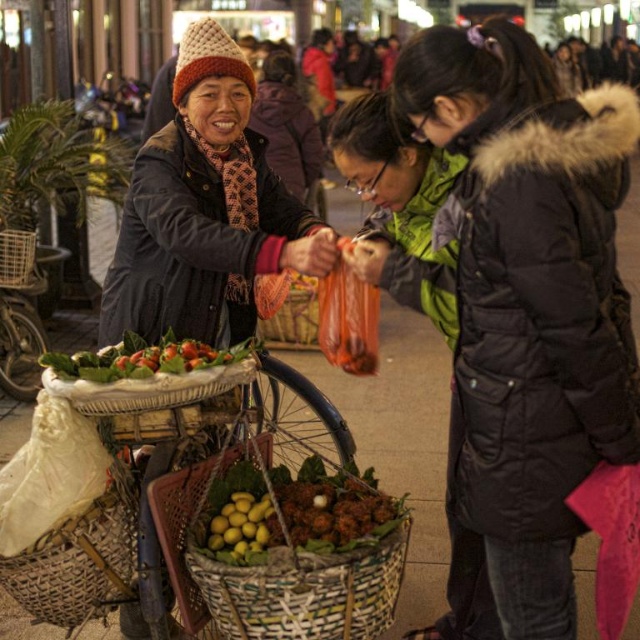
You are a customer standing in front of the bicycle cart. You see the black puffy coat at center and the woven brown basket at lower left. Which object is taller?

The black puffy coat at center is taller than the woven brown basket at lower left.

You are a customer looking to buy some root vegetables. The vendor points you to the woven brown basket at lower left and the yellow matte fruit at center. Which basket should you look in for the root vegetables?

The woven brown basket at lower left contains root vegetables like carrots or potatoes, so you should look there.

You are a customer who wants to pick up the yellow matte fruit at center. Can you reach it without moving the woven brown basket at lower left?

The woven brown basket at lower left is much taller than the yellow matte fruit at center, so it might block your access to the fruit. Move the basket to reach the fruit.